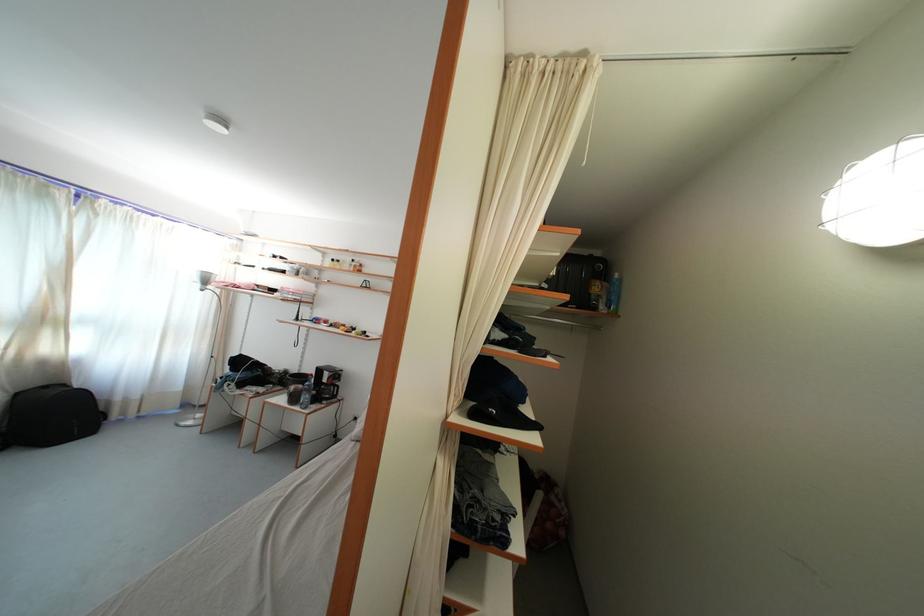
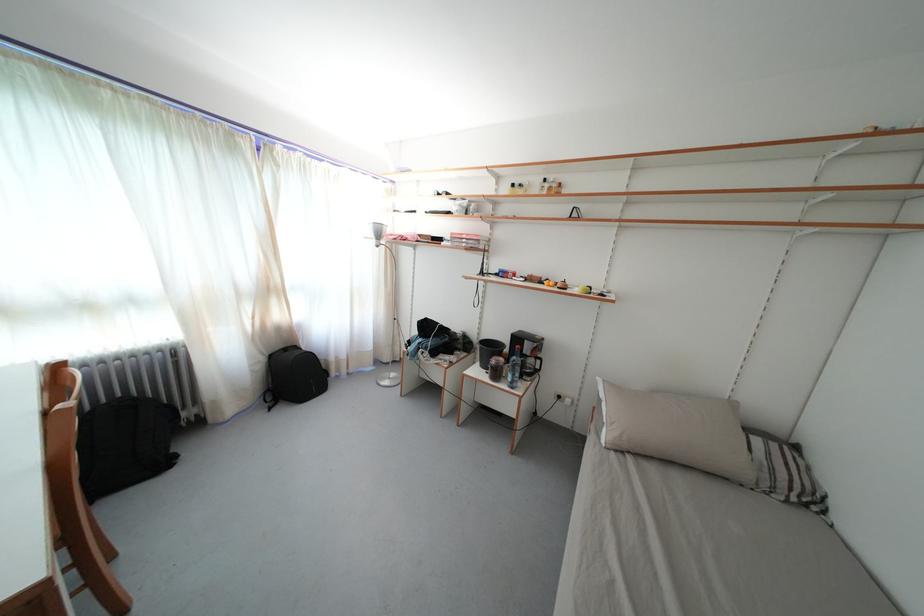
Where in the second image is the point corresponding to pixel 298 394 from the first image?

(499, 367)